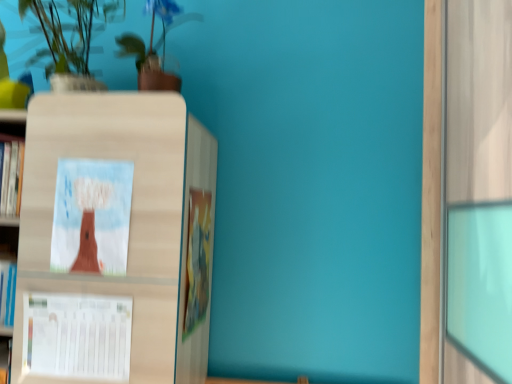
Question: In terms of width, does matte paper tree at center, arranged as the first book cover when viewed from the top, look wider or thinner when compared to hardcover book at center?

Choices:
 (A) thin
 (B) wide

Answer: (A)

Question: Based on their positions, is matte paper tree at center, acting as the second book cover starting from the bottom, located to the left or right of hardcover book at center?

Choices:
 (A) right
 (B) left

Answer: (B)

Question: Estimate the real-world distances between objects in this image. Which object is farther from the matte paper tree at center, acting as the second book cover starting from the bottom?

Choices:
 (A) green matte plant at upper left, the 1th houseplant when ordered from left to right
 (B) green matte plant at upper center, arranged as the second houseplant when viewed from the left
 (C) hardcover book at center
 (D) white paper calendar at lower left, marked as the 1th book cover in a bottom-to-top arrangement

Answer: (B)

Question: Estimate the real-world distances between objects in this image. Which object is closer to the matte paper tree at center, acting as the second book cover starting from the bottom?

Choices:
 (A) white paper calendar at lower left, marked as the second book cover in a top-to-bottom arrangement
 (B) hardcover book at center
 (C) green matte plant at upper left, which is counted as the second houseplant, starting from the right
 (D) green matte plant at upper center, which is counted as the 1th houseplant, starting from the right

Answer: (A)